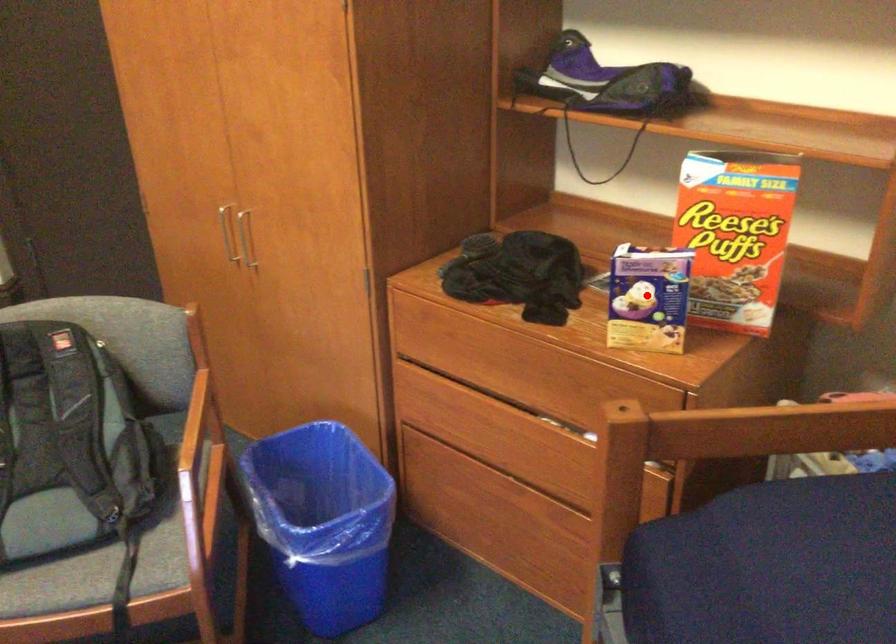
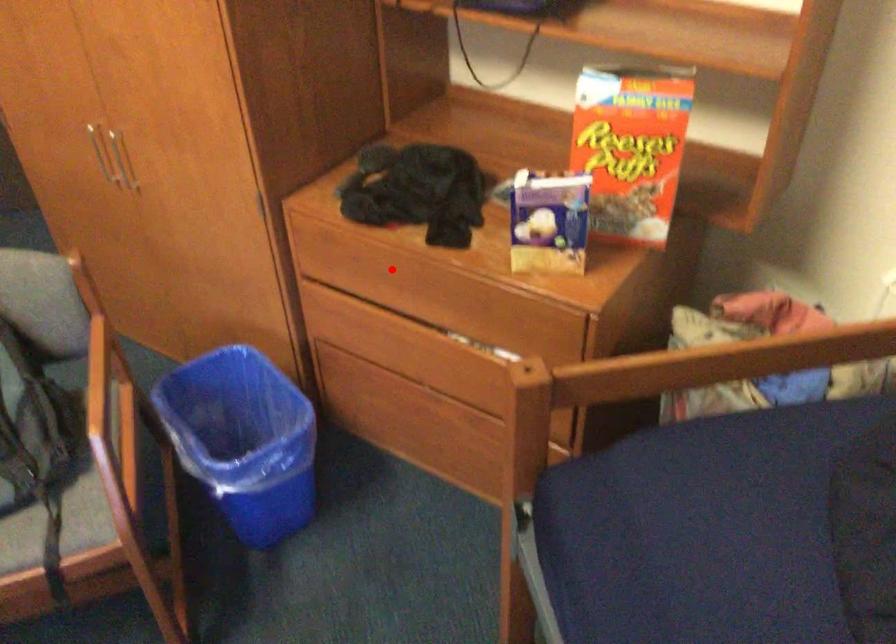
From the picture: I am providing you with two images of the same scene from different viewpoints. A red point is marked on the first image and another point is marked on the second image. Is the red point in image1 aligned with the point shown in image2?

No